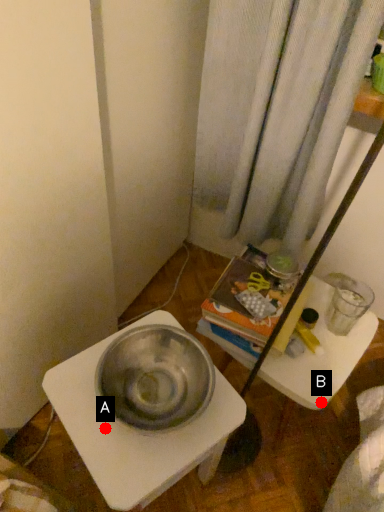
Question: Two points are circled on the image, labeled by A and B beside each circle. Which point is closer to the camera?

Choices:
 (A) A is closer
 (B) B is closer

Answer: (A)